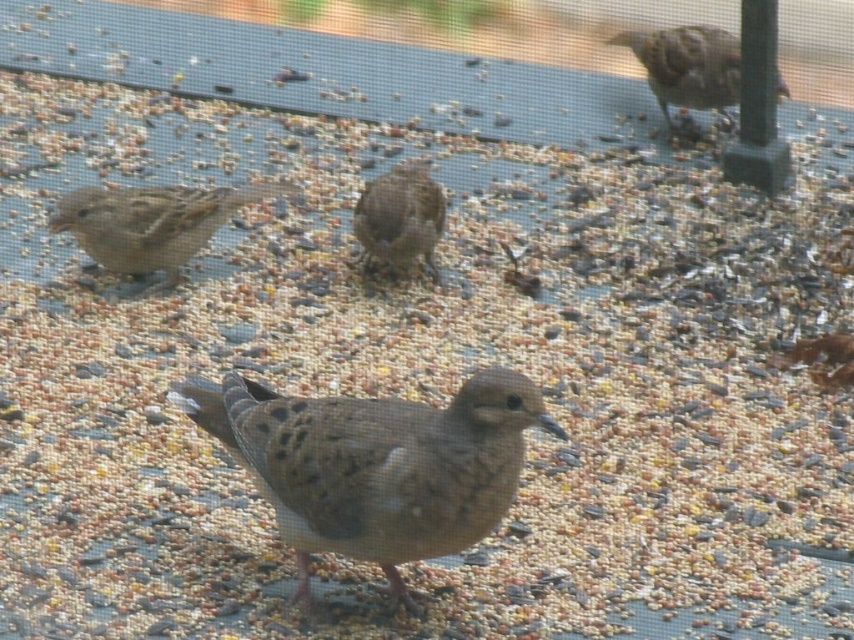
What do you see at coordinates (376, 465) in the screenshot? The image size is (854, 640). I see `brown speckled sparrow at center` at bounding box center [376, 465].

Is point (439, 429) closer to viewer compared to point (722, 86)?

Yes, it is.

At what (x,y) coordinates should I click in order to perform the action: click on brown speckled sparrow at center. Please return your answer as a coordinate pair (x, y). The width and height of the screenshot is (854, 640). Looking at the image, I should click on (376, 465).

Is brown speckled sparrow at center bigger than brown speckled sparrow at left?

Indeed, brown speckled sparrow at center has a larger size compared to brown speckled sparrow at left.

Can you confirm if brown speckled sparrow at center is wider than brown speckled sparrow at left?

Yes, brown speckled sparrow at center is wider than brown speckled sparrow at left.

Find the location of `brown speckled sparrow at center`. brown speckled sparrow at center is located at coordinates (376, 465).

Consider the image. Between brown speckled sparrow at upper right and brown speckled pigeon at center, which one appears on the right side from the viewer's perspective?

brown speckled sparrow at upper right is more to the right.

Which is in front, point (654, 68) or point (360, 227)?

Positioned in front is point (360, 227).

Identify the location of brown speckled sparrow at upper right. coord(688,67).